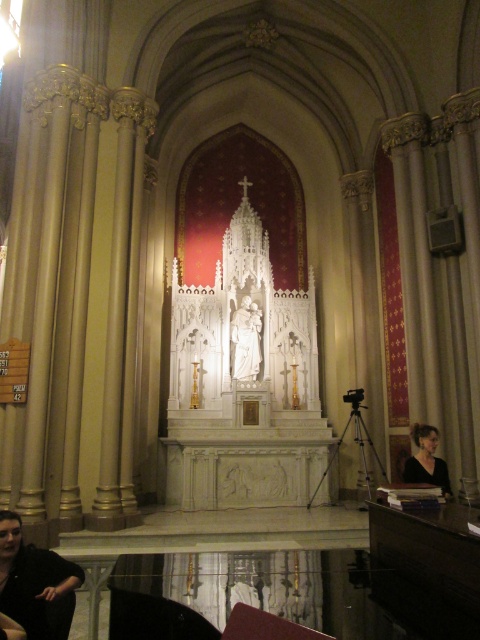
Question: Which point appears farthest from the camera in this image?

Choices:
 (A) (71, 579)
 (B) (432, 476)

Answer: (B)

Question: Is black fabric woman at lower left behind black matte dress at lower right?

Choices:
 (A) yes
 (B) no

Answer: (B)

Question: Among these objects, which one is farthest from the camera?

Choices:
 (A) black matte dress at lower right
 (B) black fabric woman at lower left

Answer: (A)

Question: Does black fabric woman at lower left appear on the left side of black matte dress at lower right?

Choices:
 (A) yes
 (B) no

Answer: (A)

Question: Observing the image, what is the correct spatial positioning of black fabric woman at lower left in reference to black matte dress at lower right?

Choices:
 (A) above
 (B) below

Answer: (B)